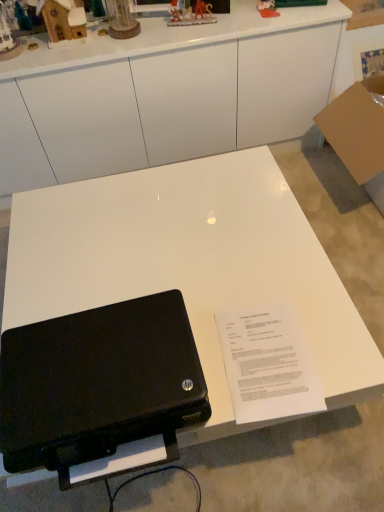
Identify the location of metallic silver sleigh at upper center, placed as the second toy when sorted from right to left. click(191, 14).

Measure the distance between metallic silver sleigh at upper center, placed as the second toy when sorted from right to left, and camera.

The distance of metallic silver sleigh at upper center, placed as the second toy when sorted from right to left, from camera is 1.57 meters.

From the picture: What is the approximate width of wooden house at upper left, the fourth toy in the right-to-left sequence?

The width of wooden house at upper left, the fourth toy in the right-to-left sequence, is 3.67 inches.

You are a GUI agent. You are given a task and a screenshot of the screen. Output one action in this format:
    pyautogui.click(x=<x>, y=<y>)
    Task: Click on the wooden house at upper left, which is counted as the second toy, starting from the left
    This screenshot has width=384, height=512.
    Given the screenshot: What is the action you would take?
    pyautogui.click(x=63, y=19)

This screenshot has height=512, width=384. What do you see at coordinates (264, 357) in the screenshot? I see `white paper at center` at bounding box center [264, 357].

Find the location of a particular element. The height and width of the screenshot is (512, 384). black matte laptop at lower left is located at coordinates (99, 384).

Locate an element on the screen. The height and width of the screenshot is (512, 384). matte wooden clock at upper center, the third toy viewed from the right is located at coordinates [121, 20].

Locate an element on the screen. This screenshot has height=512, width=384. white glossy desk at center is located at coordinates (164, 94).

Locate an element on the screen. The height and width of the screenshot is (512, 384). white glossy table at center is located at coordinates (191, 264).

From a real-world perspective, is wooden house at upper left, the 5th toy in the right-to-left sequence, above or below plastic toy at upper center, which is the 5th toy in left-to-right order?

wooden house at upper left, the 5th toy in the right-to-left sequence, is situated higher than plastic toy at upper center, which is the 5th toy in left-to-right order, in the real world.

Is wooden house at upper left, the 5th toy in the right-to-left sequence, turned away from plastic toy at upper center, which is the 5th toy in left-to-right order?

That's not correct — wooden house at upper left, the 5th toy in the right-to-left sequence, is not looking away from plastic toy at upper center, which is the 5th toy in left-to-right order.

Is wooden house at upper left, the 5th toy in the right-to-left sequence, directly adjacent to plastic toy at upper center, which ranks as the 1th toy in right-to-left order?

There is a gap between wooden house at upper left, the 5th toy in the right-to-left sequence, and plastic toy at upper center, which ranks as the 1th toy in right-to-left order.

From the image's perspective, between wooden house at upper left, the 5th toy in the right-to-left sequence, and plastic toy at upper center, which ranks as the 1th toy in right-to-left order, which one is located above?

plastic toy at upper center, which ranks as the 1th toy in right-to-left order, appears higher in the image.

Measure the distance from black matte laptop at lower left to white paper at center.

A distance of 11.50 inches exists between black matte laptop at lower left and white paper at center.

Considering the relative sizes of black matte laptop at lower left and white paper at center in the image provided, is black matte laptop at lower left bigger than white paper at center?

Indeed, black matte laptop at lower left has a larger size compared to white paper at center.

From the image's perspective, would you say black matte laptop at lower left is shown under white paper at center?

Correct, black matte laptop at lower left appears lower than white paper at center in the image.

How many degrees apart are the facing directions of black matte laptop at lower left and white paper at center?

The angular difference between black matte laptop at lower left and white paper at center is 6.89 degrees.

Is white glossy desk at center not within metallic silver sleigh at upper center, placed as the second toy when sorted from right to left?

white glossy desk at center lies outside metallic silver sleigh at upper center, placed as the second toy when sorted from right to left,'s area.

Is white glossy desk at center next to metallic silver sleigh at upper center, placed as the second toy when sorted from right to left, and touching it?

No, white glossy desk at center is not making contact with metallic silver sleigh at upper center, placed as the second toy when sorted from right to left.

From a real-world perspective, which is physically above, white glossy desk at center or metallic silver sleigh at upper center, placed as the second toy when sorted from right to left?

In real-world perspective, metallic silver sleigh at upper center, placed as the second toy when sorted from right to left, is above.

From the image's perspective, between white glossy desk at center and metallic silver sleigh at upper center, placed as the second toy when sorted from right to left, who is located below?

white glossy desk at center appears lower in the image.

In the image, is black matte laptop at lower left positioned in front of or behind metallic silver sleigh at upper center, the 4th toy in the left-to-right sequence?

Visually, black matte laptop at lower left is located in front of metallic silver sleigh at upper center, the 4th toy in the left-to-right sequence.

The width and height of the screenshot is (384, 512). Find the location of `laptop below the metallic silver sleigh at upper center, the 4th toy in the left-to-right sequence (from the image's perspective)`. laptop below the metallic silver sleigh at upper center, the 4th toy in the left-to-right sequence (from the image's perspective) is located at coordinates (99, 384).

Does black matte laptop at lower left contain metallic silver sleigh at upper center, placed as the second toy when sorted from right to left?

No, metallic silver sleigh at upper center, placed as the second toy when sorted from right to left, is not a part of black matte laptop at lower left.

From a real-world perspective, does black matte laptop at lower left sit lower than metallic silver sleigh at upper center, placed as the second toy when sorted from right to left?

Yes, from a real-world perspective, black matte laptop at lower left is below metallic silver sleigh at upper center, placed as the second toy when sorted from right to left.

Which is behind, point (2, 417) or point (128, 19)?

Point (128, 19)

Who is shorter, black matte laptop at lower left or matte wooden clock at upper center, the third toy viewed from the right?

With less height is black matte laptop at lower left.

Are black matte laptop at lower left and matte wooden clock at upper center, the third toy viewed from the right, far apart?

black matte laptop at lower left is positioned a significant distance from matte wooden clock at upper center, the third toy viewed from the right.

What are the coordinates of `laptop below the matte wooden clock at upper center, the third toy viewed from the right (from the image's perspective)` in the screenshot? It's located at (99, 384).

Is white glossy table at center taller or shorter than brown cardboard at right?

In the image, white glossy table at center appears to be shorter than brown cardboard at right.

From a real-world perspective, between white glossy table at center and brown cardboard at right, who is vertically lower?

From a 3D spatial view, white glossy table at center is below.

Is white glossy table at center wider than brown cardboard at right?

Indeed, white glossy table at center has a greater width compared to brown cardboard at right.

Does white glossy table at center have a larger size compared to brown cardboard at right?

Yes.

Identify the location of toy that is the 1st one when counting downward from the plastic toy at upper center, which ranks as the 1th toy in right-to-left order (from the image's perspective). (191, 14).

Is metallic silver sleigh at upper center, placed as the second toy when sorted from right to left, inside the boundaries of plastic toy at upper center, which is the 5th toy in left-to-right order, or outside?

metallic silver sleigh at upper center, placed as the second toy when sorted from right to left, is not inside plastic toy at upper center, which is the 5th toy in left-to-right order, it's outside.

From the image's perspective, which is below, metallic silver sleigh at upper center, placed as the second toy when sorted from right to left, or plastic toy at upper center, which ranks as the 1th toy in right-to-left order?

From the image's view, metallic silver sleigh at upper center, placed as the second toy when sorted from right to left, is below.

What are the coordinates of `the 2nd toy positioned above the plastic toy at upper center, which ranks as the 1th toy in right-to-left order (from a real-world perspective)` in the screenshot? It's located at (8, 41).

Find the location of a particular element. The image size is (384, 512). writing that appears below the black matte laptop at lower left (from a real-world perspective) is located at coordinates tap(264, 357).

When comparing their distances from brown cardboard at right, does wooden house at upper left, the 5th toy in the right-to-left sequence, or plastic toy at upper center, which is the 5th toy in left-to-right order, seem further?

wooden house at upper left, the 5th toy in the right-to-left sequence, is further to brown cardboard at right.

Looking at the image, which one is located closer to matte wooden clock at upper center, the third toy viewed from the right, wooden house at upper left, which is counted as the second toy, starting from the left, or metallic silver sleigh at upper center, the 4th toy in the left-to-right sequence?

Based on the image, wooden house at upper left, which is counted as the second toy, starting from the left, appears to be nearer to matte wooden clock at upper center, the third toy viewed from the right.

In the scene shown: Considering their positions, is metallic silver sleigh at upper center, placed as the second toy when sorted from right to left, positioned closer to wooden house at upper left, the fourth toy in the right-to-left sequence, than plastic toy at upper center, which ranks as the 1th toy in right-to-left order?

The object closer to wooden house at upper left, the fourth toy in the right-to-left sequence, is metallic silver sleigh at upper center, placed as the second toy when sorted from right to left.

Looking at this image, which object lies further to the anchor point white paper at center, matte wooden clock at upper center, the third toy viewed from the right, or wooden house at upper left, the fourth toy in the right-to-left sequence?

wooden house at upper left, the fourth toy in the right-to-left sequence, is positioned further to the anchor white paper at center.

When comparing their distances from metallic silver sleigh at upper center, the 4th toy in the left-to-right sequence, does matte wooden clock at upper center, the third toy viewed from the right, or plastic toy at upper center, which is the 5th toy in left-to-right order, seem further?

The object further to metallic silver sleigh at upper center, the 4th toy in the left-to-right sequence, is plastic toy at upper center, which is the 5th toy in left-to-right order.

Consider the image. Based on their spatial positions, is white glossy table at center or black matte laptop at lower left closer to metallic silver sleigh at upper center, the 4th toy in the left-to-right sequence?

white glossy table at center.

Which object lies further to the anchor point brown cardboard at right, matte wooden clock at upper center, the third toy when ordered from left to right, or white glossy table at center?

matte wooden clock at upper center, the third toy when ordered from left to right, is positioned further to the anchor brown cardboard at right.

Which object lies nearer to the anchor point white paper at center, wooden house at upper left, which ranks as the first toy in left-to-right order, or white glossy desk at center?

Based on the image, white glossy desk at center appears to be nearer to white paper at center.

The image size is (384, 512). I want to click on toy between wooden house at upper left, the fourth toy in the right-to-left sequence, and white paper at center vertically, so click(8, 41).

At what (x,y) coordinates should I click in order to perform the action: click on desk that lies between wooden house at upper left, the fourth toy in the right-to-left sequence, and white paper at center from top to bottom. Please return your answer as a coordinate pair (x, y). The height and width of the screenshot is (512, 384). Looking at the image, I should click on (164, 94).

Locate an element on the screen. writing between wooden house at upper left, the fourth toy in the right-to-left sequence, and brown cardboard at right is located at coordinates (264, 357).

Locate an element on the screen. toy between metallic silver sleigh at upper center, placed as the second toy when sorted from right to left, and brown cardboard at right, in the horizontal direction is located at coordinates (267, 9).